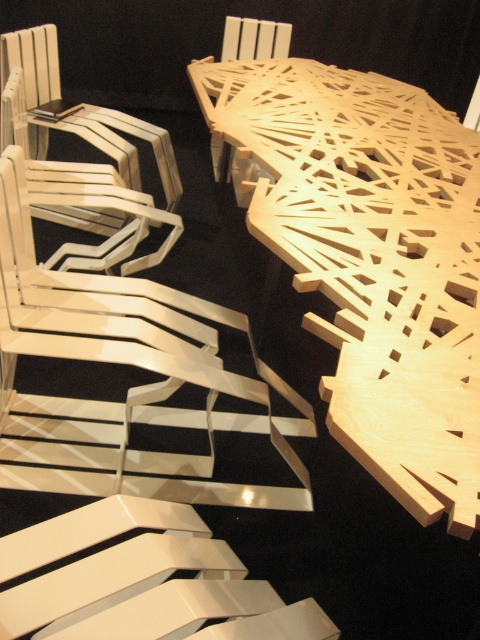
Question: Which object is the closest to the white wood chair at left?

Choices:
 (A) wooden chair at upper center
 (B) matte white chair at upper left
 (C) natural wood table at center

Answer: (C)

Question: Is natural wood table at center above white wood chair at left?

Choices:
 (A) no
 (B) yes

Answer: (B)

Question: Among these objects, which one is nearest to the camera?

Choices:
 (A) white wood chair at left
 (B) natural wood table at center
 (C) matte white chair at upper left

Answer: (B)

Question: Which object appears closest to the camera in this image?

Choices:
 (A) natural wood table at center
 (B) wooden chair at upper center

Answer: (A)

Question: Can you confirm if matte white chair at upper left is positioned to the left of wooden chair at upper center?

Choices:
 (A) no
 (B) yes

Answer: (B)

Question: Does white wood chair at left appear on the right side of matte white chair at upper left?

Choices:
 (A) no
 (B) yes

Answer: (B)